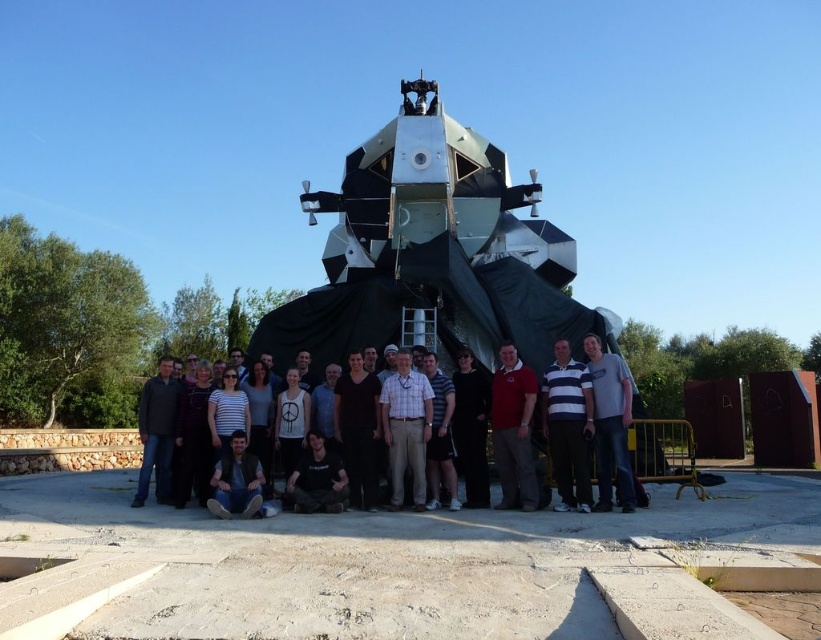
You are a photographer taking a group photo of the people in front of the spacecraft. You notice the matte black shirt at center and the dark brown leather jacket at lower center. Which clothing item is covering part of the other?

The matte black shirt at center is positioned over dark brown leather jacket at lower center, so it is covering part of the jacket.

In the scene shown: You are part of the group standing in front of the spacecraft structure. You notice two people wearing a matte black shirt at center and a striped cotton shirt at center. Which person is standing closer to the front of the group?

The matte black shirt at center is positioned under the striped cotton shirt at center, meaning the person wearing the striped cotton shirt at center is standing closer to the front of the group.

You are organizing a photo shoot for a team in front of the spacecraft structure. Two team members are wearing the matte black shirt at center and the matte red shirt at center. From the photographer standing at the front, which shirt is positioned to the left?

The matte black shirt at center is to the left of the matte red shirt at center, so from the photographer standing at the front, the matte black shirt at center is positioned to the left.